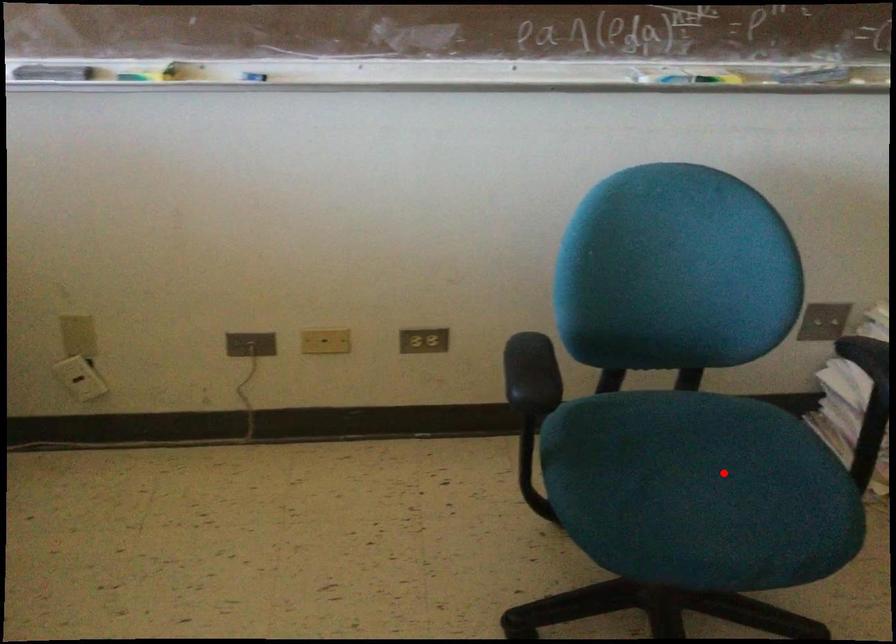
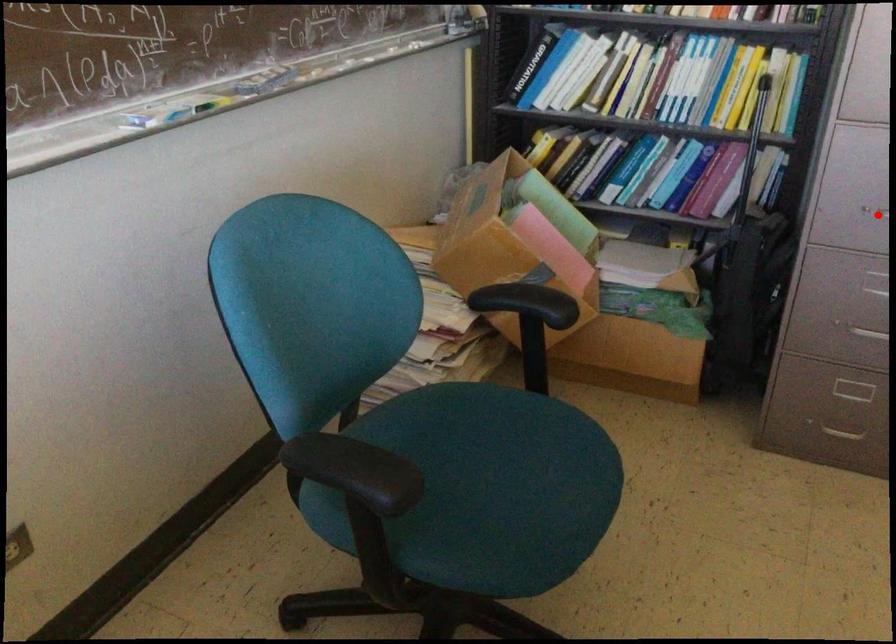
I am providing you with two images of the same scene from different viewpoints. A red point is marked on the first image and another point is marked on the second image. Is the red point in image1 aligned with the point shown in image2?

No